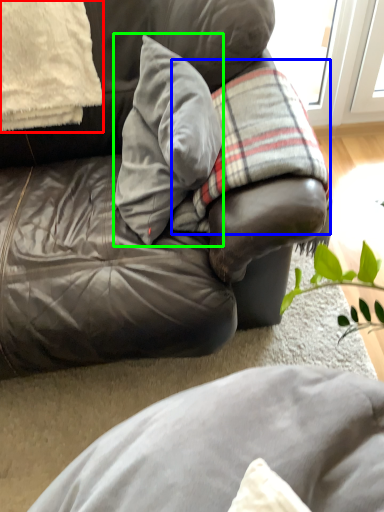
Question: Based on their relative distances, which object is farther from pillow (highlighted by a red box)? Choose from plaid (highlighted by a blue box) and pillow (highlighted by a green box).

Choices:
 (A) plaid
 (B) pillow

Answer: (A)